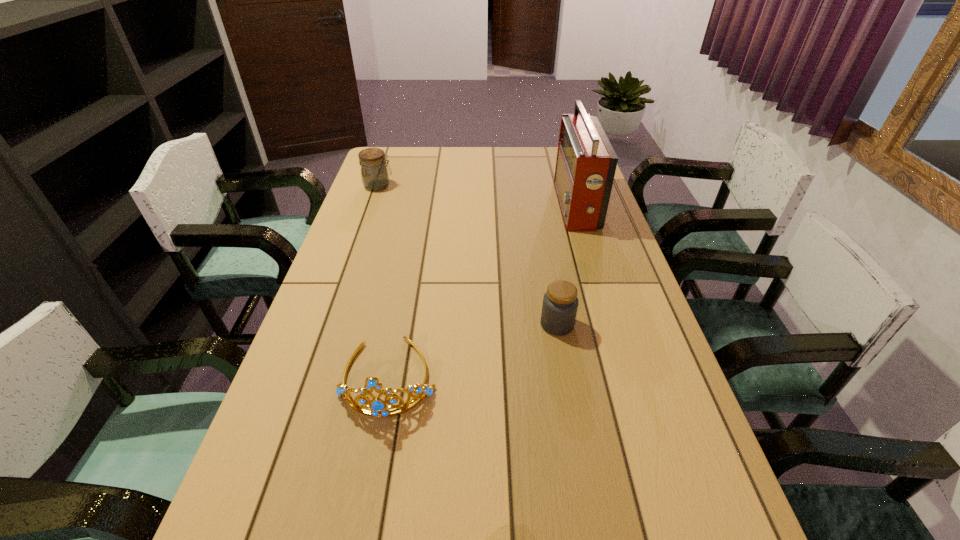
I want to click on the tallest object, so click(586, 162).

Locate an element on the screen. the rightmost object is located at coordinates (586, 162).

Identify the location of the leftmost object. This screenshot has width=960, height=540. (374, 173).

Find the location of a particular element. The width and height of the screenshot is (960, 540). the left jar is located at coordinates (374, 173).

The height and width of the screenshot is (540, 960). I want to click on the nearest object, so click(379, 408).

Where is `the second object from left to right`? The width and height of the screenshot is (960, 540). the second object from left to right is located at coordinates tap(379, 408).

Identify the location of the right jar. The width and height of the screenshot is (960, 540). (560, 303).

The width and height of the screenshot is (960, 540). Find the location of `the second object from right to left`. the second object from right to left is located at coordinates (560, 303).

The image size is (960, 540). I want to click on free spot located on the front-facing side of the radio receiver, so [x=525, y=206].

Where is `blank space located 0.280m on the front-facing side of the radio receiver`? blank space located 0.280m on the front-facing side of the radio receiver is located at coordinates (477, 206).